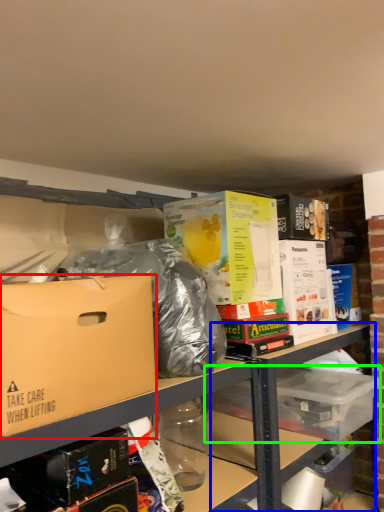
Question: Which is farther away from box (highlighted by a red box)? table (highlighted by a blue box) or storage box (highlighted by a green box)?

Choices:
 (A) table
 (B) storage box

Answer: (B)